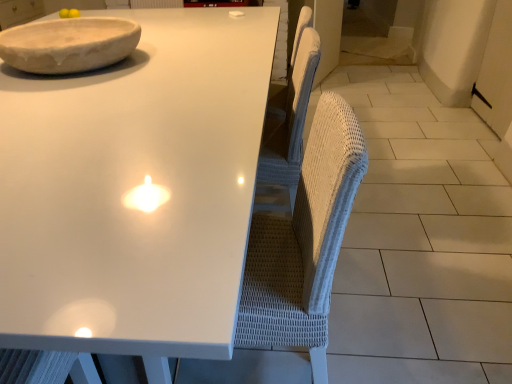
What is the approximate width of white glossy table at upper center?

→ white glossy table at upper center is 1.38 meters wide.

The height and width of the screenshot is (384, 512). What do you see at coordinates (69, 44) in the screenshot? I see `white marble bowl at upper left` at bounding box center [69, 44].

The width and height of the screenshot is (512, 384). I want to click on white wicker swivel chair at center, so click(304, 243).

From the picture: Which is further, [42,39] or [96,134]?

The point [42,39] is farther.

In the scene shown: Can you confirm if white marble bowl at upper left is bigger than white glossy table at upper center?

No, white marble bowl at upper left is not bigger than white glossy table at upper center.

Which object is further away from the camera taking this photo, white marble bowl at upper left or white glossy table at upper center?

white marble bowl at upper left.

What's the angular difference between white marble bowl at upper left and white wicker swivel chair at center's facing directions?

They differ by 179 degrees in their facing directions.

In the scene shown: Is white marble bowl at upper left positioned with its back to white wicker swivel chair at center?

No, white marble bowl at upper left's orientation is not away from white wicker swivel chair at center.

Is white marble bowl at upper left in front of white wicker swivel chair at center?

No, white marble bowl at upper left is further to the viewer.

From a real-world perspective, is white marble bowl at upper left above or below white wicker swivel chair at center?

white marble bowl at upper left is above white wicker swivel chair at center.

From the picture: Which object is positioned more to the left, white glossy table at upper center or white marble bowl at upper left?

Positioned to the left is white marble bowl at upper left.

Is white glossy table at upper center wider than white marble bowl at upper left?

Correct, the width of white glossy table at upper center exceeds that of white marble bowl at upper left.

From a real-world perspective, relative to white marble bowl at upper left, is white glossy table at upper center vertically above or below?

Clearly, from a real-world perspective, white glossy table at upper center is below white marble bowl at upper left.

What's the angular difference between white glossy table at upper center and white marble bowl at upper left's facing directions?

The facing directions of white glossy table at upper center and white marble bowl at upper left are 1.3 degrees apart.

From a real-world perspective, which is physically above, white glossy table at upper center or white wicker swivel chair at center?

In real-world perspective, white wicker swivel chair at center is above.

Considering the positions of objects white glossy table at upper center and white wicker swivel chair at center in the image provided, who is more to the left, white glossy table at upper center or white wicker swivel chair at center?

Positioned to the left is white glossy table at upper center.

Is point (23, 226) positioned after point (300, 208)?

No.

In the scene shown: From the image's perspective, who appears lower, white glossy table at upper center or white wicker swivel chair at center?

white wicker swivel chair at center is shown below in the image.

From their relative heights in the image, would you say white wicker swivel chair at center is taller or shorter than white glossy table at upper center?

Considering their sizes, white wicker swivel chair at center has more height than white glossy table at upper center.

Is white wicker swivel chair at center bigger than white glossy table at upper center?

Actually, white wicker swivel chair at center might be smaller than white glossy table at upper center.

Consider the image. Between white wicker swivel chair at center and white glossy table at upper center, which one has smaller width?

white wicker swivel chair at center.

How far apart are white wicker swivel chair at center and white glossy table at upper center?

white wicker swivel chair at center is 14.77 inches away from white glossy table at upper center.

From the image's perspective, which one is positioned higher, white wicker swivel chair at center or white marble bowl at upper left?

white marble bowl at upper left.

Can you confirm if white wicker swivel chair at center is positioned to the right of white marble bowl at upper left?

Indeed, white wicker swivel chair at center is positioned on the right side of white marble bowl at upper left.

Can you tell me how much white wicker swivel chair at center and white marble bowl at upper left differ in facing direction?

The facing directions of white wicker swivel chair at center and white marble bowl at upper left are 179 degrees apart.

How far apart are white wicker swivel chair at center and white marble bowl at upper left?

white wicker swivel chair at center is 38.04 inches away from white marble bowl at upper left.

This screenshot has height=384, width=512. Identify the location of bowl above the white glossy table at upper center (from the image's perspective). click(x=69, y=44).

Locate an element on the screen. The height and width of the screenshot is (384, 512). swivel chair that appears on the right of white marble bowl at upper left is located at coordinates (304, 243).

When comparing their distances from white glossy table at upper center, does white wicker swivel chair at center or white marble bowl at upper left seem closer?

white marble bowl at upper left lies closer to white glossy table at upper center than the other object.

Looking at the image, which one is located further to white wicker swivel chair at center, white glossy table at upper center or white marble bowl at upper left?

white marble bowl at upper left lies further to white wicker swivel chair at center than the other object.

Looking at the image, which one is located further to white glossy table at upper center, white marble bowl at upper left or white wicker swivel chair at center?

white wicker swivel chair at center.

Considering their positions, is white marble bowl at upper left positioned closer to white wicker swivel chair at center than white glossy table at upper center?

Based on the image, white glossy table at upper center appears to be nearer to white wicker swivel chair at center.

Which object lies further to the anchor point white marble bowl at upper left, white glossy table at upper center or white wicker swivel chair at center?

white wicker swivel chair at center.

When comparing their distances from white marble bowl at upper left, does white wicker swivel chair at center or white glossy table at upper center seem further?

Based on the image, white wicker swivel chair at center appears to be further to white marble bowl at upper left.

Where is `swivel chair between white glossy table at upper center and white marble bowl at upper left in the front-back direction`? The image size is (512, 384). swivel chair between white glossy table at upper center and white marble bowl at upper left in the front-back direction is located at coordinates (304, 243).